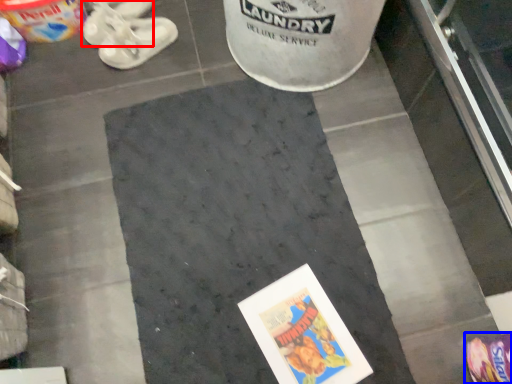
Question: Which object appears farthest to the camera in this image, footwear (highlighted by a red box) or footwear (highlighted by a blue box)?

Choices:
 (A) footwear
 (B) footwear

Answer: (A)